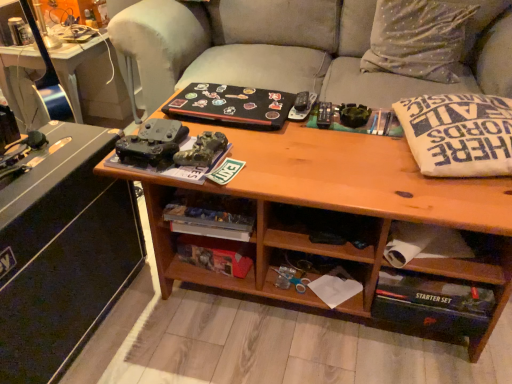
What do you see at coordinates (216, 254) in the screenshot? I see `hardcover book at lower center, positioned as the 2th book in top-to-bottom order` at bounding box center [216, 254].

Measure the distance between point (440, 24) and camera.

They are 6.51 feet apart.

This screenshot has height=384, width=512. What do you see at coordinates (442, 253) in the screenshot? I see `wooden drawer at lower right` at bounding box center [442, 253].

The height and width of the screenshot is (384, 512). What do you see at coordinates (231, 106) in the screenshot?
I see `black matte book at center, which ranks as the second book in bottom-to-top order` at bounding box center [231, 106].

This screenshot has height=384, width=512. Describe the element at coordinates (93, 79) in the screenshot. I see `metallic black game controllers at left` at that location.

This screenshot has height=384, width=512. Find the location of `hardcover book at lower center, positioned as the 2th book in top-to-bottom order`. hardcover book at lower center, positioned as the 2th book in top-to-bottom order is located at coordinates (216, 254).

Does silky silver pillow at upper right have a greater height compared to white cotton pillow at right?

Yes.

From the image's perspective, which one is positioned higher, silky silver pillow at upper right or white cotton pillow at right?

silky silver pillow at upper right appears higher in the image.

Considering the relative sizes of silky silver pillow at upper right and white cotton pillow at right in the image provided, is silky silver pillow at upper right wider than white cotton pillow at right?

No.

Is silky silver pillow at upper right in contact with white cotton pillow at right?

There is a gap between silky silver pillow at upper right and white cotton pillow at right.

From a real-world perspective, is black matte book at center, the 1th book from the top, beneath hardcover book at lower center, positioned as the 2th book in top-to-bottom order?

No.

Is black matte book at center, which ranks as the second book in bottom-to-top order, positioned far away from hardcover book at lower center, positioned as the 2th book in top-to-bottom order?

That's not correct — black matte book at center, which ranks as the second book in bottom-to-top order, is a little close to hardcover book at lower center, positioned as the 2th book in top-to-bottom order.

Does wooden drawer at lower right have a lesser width compared to white cotton pillow at right?

Correct, the width of wooden drawer at lower right is less than that of white cotton pillow at right.

From a real-world perspective, relative to white cotton pillow at right, is wooden drawer at lower right vertically above or below?

From a real-world perspective, wooden drawer at lower right is physically below white cotton pillow at right.

Could you tell me if wooden drawer at lower right is facing white cotton pillow at right?

No, wooden drawer at lower right does not turn towards white cotton pillow at right.

Would you say black matte book at center, the 1th book from the top, is outside silky silver pillow at upper right?

Yes, black matte book at center, the 1th book from the top, is outside of silky silver pillow at upper right.

Considering their positions, is black matte book at center, which ranks as the second book in bottom-to-top order, located in front of or behind silky silver pillow at upper right?

Clearly, black matte book at center, which ranks as the second book in bottom-to-top order, is in front of silky silver pillow at upper right.

Where is `the 1st book to the left of the silky silver pillow at upper right, counting from the anchor's position`? Image resolution: width=512 pixels, height=384 pixels. the 1st book to the left of the silky silver pillow at upper right, counting from the anchor's position is located at coordinates (x=231, y=106).

Considering the positions of point (213, 121) and point (436, 5), is point (213, 121) closer or farther from the camera than point (436, 5)?

Point (213, 121).

The height and width of the screenshot is (384, 512). Identify the location of drawer directly beneath the white cotton pillow at right (from a real-world perspective). (442, 253).

From the image's perspective, which is above, white cotton pillow at right or wooden drawer at lower right?

white cotton pillow at right appears higher in the image.

In terms of height, does white cotton pillow at right look taller or shorter compared to wooden drawer at lower right?

Considering their sizes, white cotton pillow at right has more height than wooden drawer at lower right.

From a real-world perspective, relative to wooden drawer at lower right, is white cotton pillow at right vertically above or below?

In terms of real-world spatial position, white cotton pillow at right is above wooden drawer at lower right.

Which is more to the right, metallic black game controllers at left or wooden drawer at lower right?

From the viewer's perspective, wooden drawer at lower right appears more on the right side.

Is metallic black game controllers at left looking in the opposite direction of wooden drawer at lower right?

That's not correct — metallic black game controllers at left is not looking away from wooden drawer at lower right.

Can you tell me how much metallic black game controllers at left and wooden drawer at lower right differ in facing direction?

The angular difference between metallic black game controllers at left and wooden drawer at lower right is 90 degrees.

Consider the image. Considering the sizes of objects metallic black game controllers at left and wooden drawer at lower right in the image provided, who is wider, metallic black game controllers at left or wooden drawer at lower right?

metallic black game controllers at left is wider.

Based on the photo, from the image's perspective, between wooden drawer at lower right and gray fabric couch at center, who is located below?

From the image's view, wooden drawer at lower right is below.

Is wooden drawer at lower right completely or partially outside of gray fabric couch at center?

Yes, wooden drawer at lower right is located beyond the bounds of gray fabric couch at center.

Which is more to the left, wooden drawer at lower right or gray fabric couch at center?

Positioned to the left is gray fabric couch at center.

Which is less distant, (x=510, y=246) or (x=148, y=69)?

Point (x=510, y=246) appears to be closer to the viewer than point (x=148, y=69).

The width and height of the screenshot is (512, 384). In order to click on throw pillow on the right of white cotton pillow at right in this screenshot , I will do `click(418, 38)`.

Locate an element on the screen. book that is on the left side of black matte book at center, which ranks as the second book in bottom-to-top order is located at coordinates (216, 254).

Based on their spatial positions, is wooden drawer at lower right or white cotton pillow at right closer to gray fabric couch at center?

white cotton pillow at right.

When comparing their distances from gray fabric couch at center, does wooden drawer at lower right or black matte book at center, which ranks as the second book in bottom-to-top order, seem further?

Among the two, wooden drawer at lower right is located further to gray fabric couch at center.

Based on their spatial positions, is white cotton pillow at right or black matte book at center, the 1th book from the top, closer to gray fabric couch at center?

black matte book at center, the 1th book from the top, lies closer to gray fabric couch at center than the other object.

Which object lies further to the anchor point matte black desk at left, gray fabric couch at center or metallic black game controllers at left?

gray fabric couch at center.

Which object lies nearer to the anchor point white cotton pillow at right, metallic black game controllers at left or silky silver pillow at upper right?

Among the two, silky silver pillow at upper right is located nearer to white cotton pillow at right.

From the image, which object appears to be farther from matte black desk at left, silky silver pillow at upper right or wooden drawer at lower right?

silky silver pillow at upper right is further to matte black desk at left.

Which object lies further to the anchor point white cotton pillow at right, matte black desk at left or silky silver pillow at upper right?

The object further to white cotton pillow at right is matte black desk at left.

When comparing their distances from hardcover book at lower center, positioned as the 2th book in top-to-bottom order, does black matte book at center, the 1th book from the top, or gray fabric couch at center seem closer?

black matte book at center, the 1th book from the top.

The image size is (512, 384). Find the location of `book situated between hardcover book at lower center, which is the first book from bottom to top, and silky silver pillow at upper right from left to right`. book situated between hardcover book at lower center, which is the first book from bottom to top, and silky silver pillow at upper right from left to right is located at coordinates (231, 106).

You are a GUI agent. You are given a task and a screenshot of the screen. Output one action in this format:
    pyautogui.click(x=<x>, y=<y>)
    Task: Click on the studio couch between matte black desk at left and wooden drawer at lower right in the horizontal direction
    
    Given the screenshot: What is the action you would take?
    pyautogui.click(x=321, y=47)

This screenshot has height=384, width=512. In order to click on drawer between silky silver pillow at upper right and hardcover book at lower center, which is the first book from bottom to top, vertically in this screenshot , I will do `click(442, 253)`.

This screenshot has height=384, width=512. Identify the location of book that lies between gray fabric couch at center and hardcover book at lower center, which is the first book from bottom to top, from top to bottom. (231, 106).